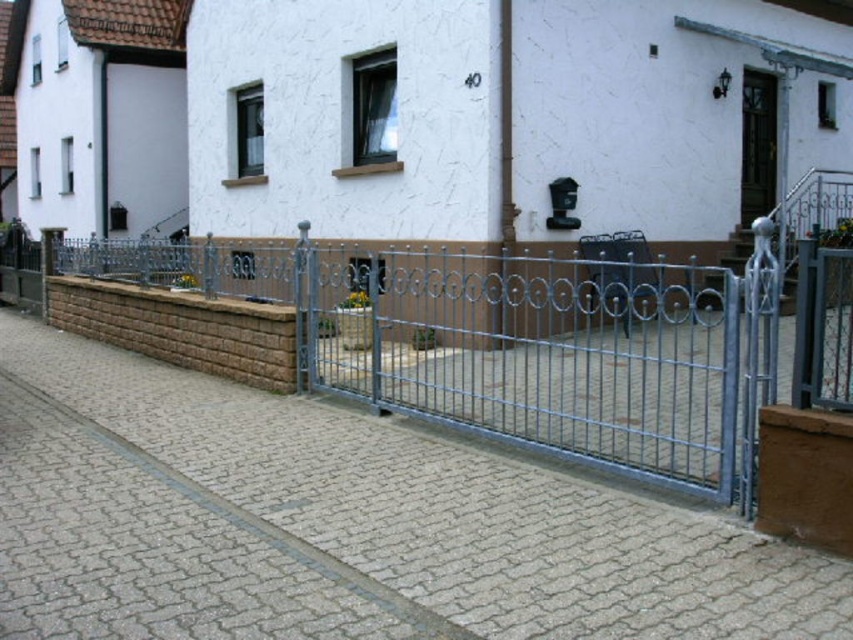
Question: Can you confirm if silver metallic gate at center is positioned to the right of brown wooden door at upper right?

Choices:
 (A) yes
 (B) no

Answer: (B)

Question: Can you confirm if silver metallic gate at center is smaller than brown wooden door at upper right?

Choices:
 (A) yes
 (B) no

Answer: (B)

Question: Which point is closer to the camera?

Choices:
 (A) brown wooden door at upper right
 (B) silver metallic gate at center

Answer: (B)

Question: Is silver metallic gate at center positioned at the back of brown wooden door at upper right?

Choices:
 (A) no
 (B) yes

Answer: (A)

Question: Among these points, which one is farthest from the camera?

Choices:
 (A) (288, 262)
 (B) (761, 120)

Answer: (B)